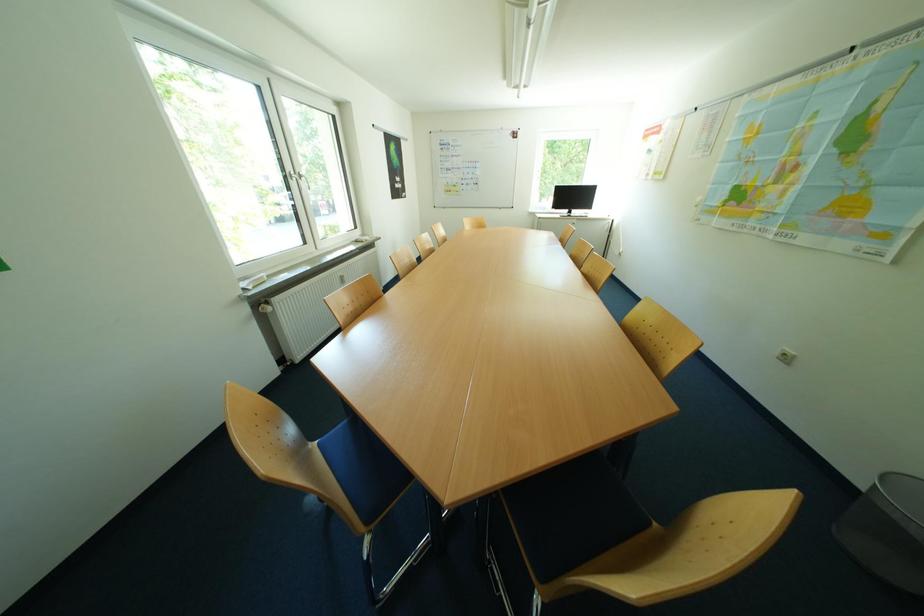
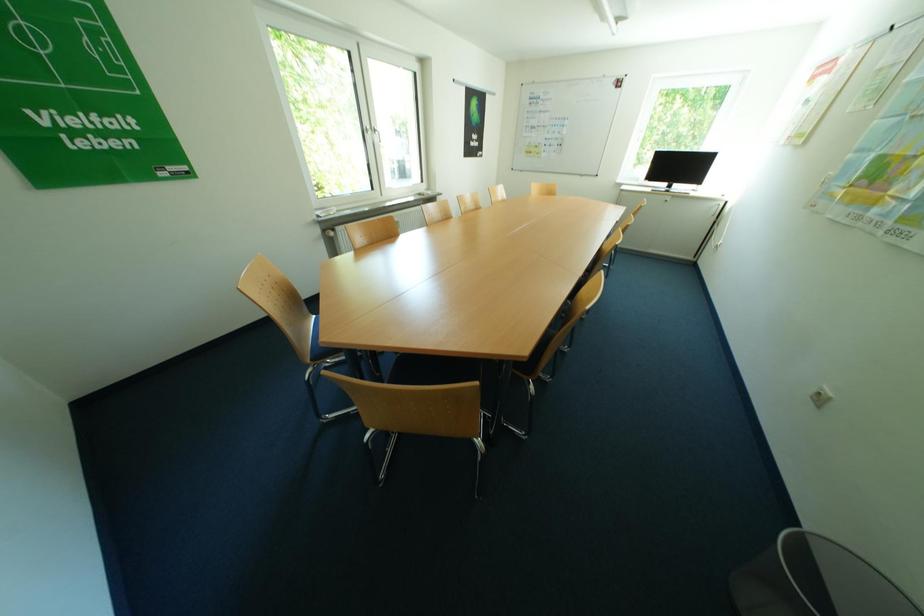
Question: The images are taken continuously from a first-person perspective. In which direction are you moving?

Choices:
 (A) Left
 (B) Right
 (C) Forward
 (D) Backward

Answer: (B)